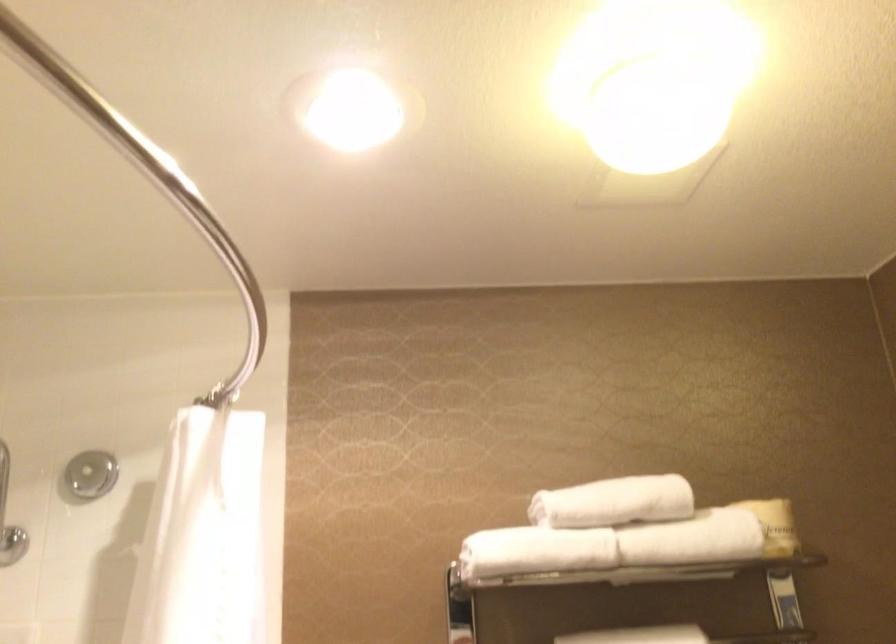
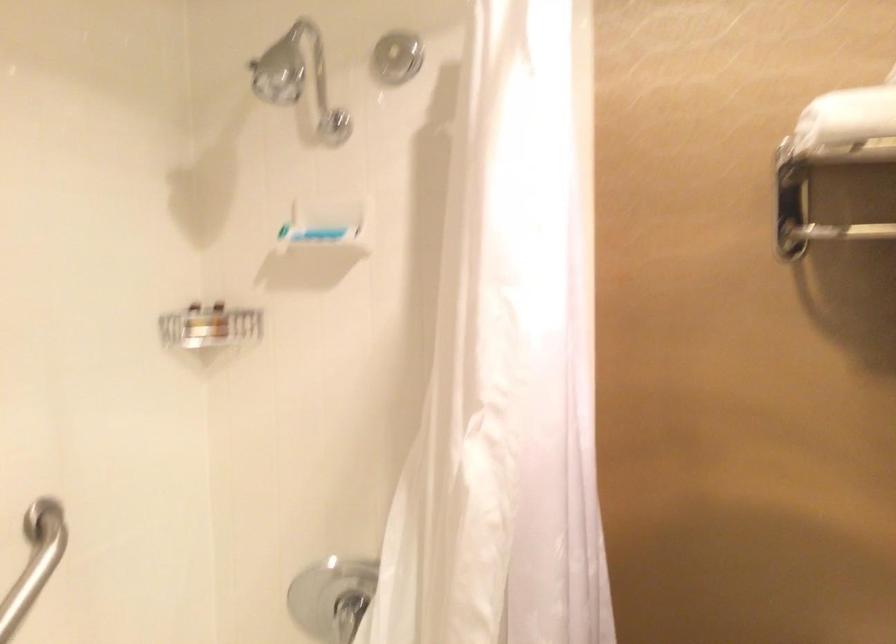
Locate, in the second image, the point that corresponds to (x=495, y=564) in the first image.

(846, 118)